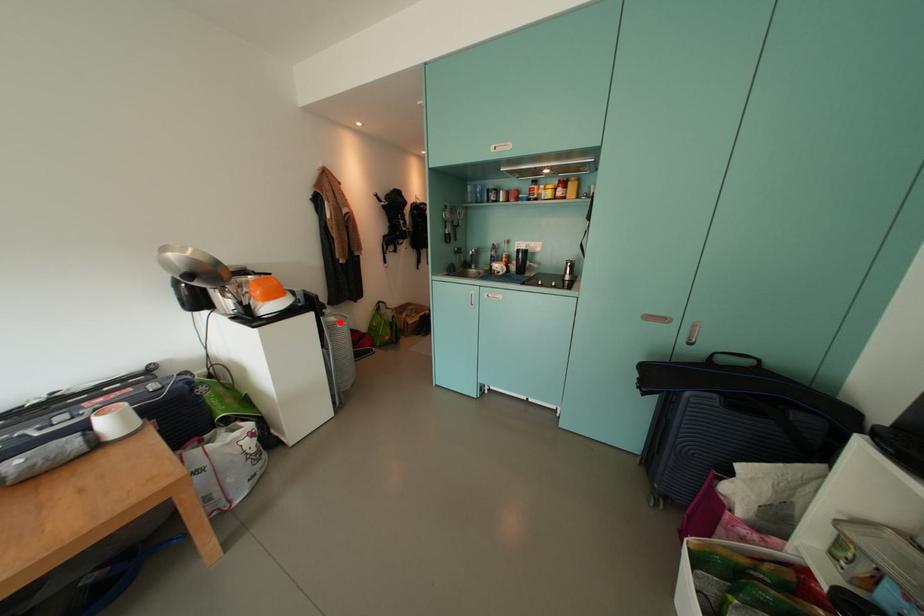
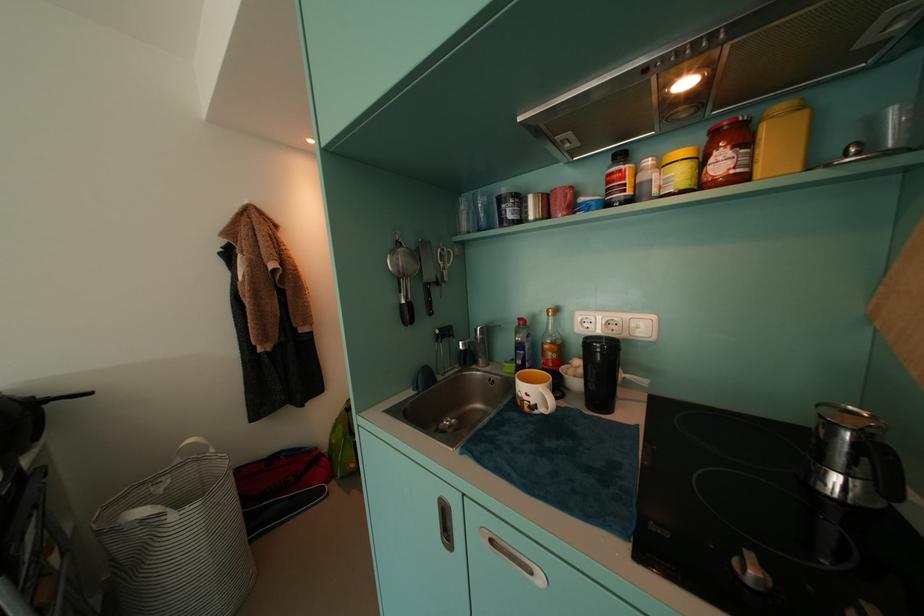
Question: I am providing you with two images of the same scene from different viewpoints. Given a red point in image1, look at the same physical point in image2. Is it:

Choices:
 (A) Closer to the viewpoint
 (B) Farther from the viewpoint

Answer: (B)